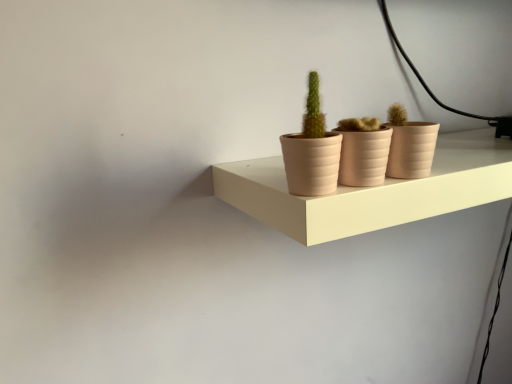
Question: Is matte clay flowerpot at center, which ranks as the first flowerpot in left-to-right order, inside the boundaries of matte beige shelf at center, or outside?

Choices:
 (A) inside
 (B) outside

Answer: (B)

Question: Looking at their shapes, would you say matte clay flowerpot at center, which ranks as the 2th flowerpot in right-to-left order, is wider or thinner than matte beige shelf at center?

Choices:
 (A) wide
 (B) thin

Answer: (B)

Question: Considering the real-world distances, which object is closest to the matte pink flowerpot at center, the first flowerpot viewed from the right?

Choices:
 (A) matte pink pot at center
 (B) matte clay flowerpot at center, which ranks as the first flowerpot in left-to-right order
 (C) matte beige shelf at center

Answer: (B)

Question: Estimate the real-world distances between objects in this image. Which object is closer to the matte clay flowerpot at center, which ranks as the 2th flowerpot in right-to-left order?

Choices:
 (A) matte pink flowerpot at center, which ranks as the second flowerpot in left-to-right order
 (B) matte beige shelf at center
 (C) matte pink pot at center

Answer: (C)